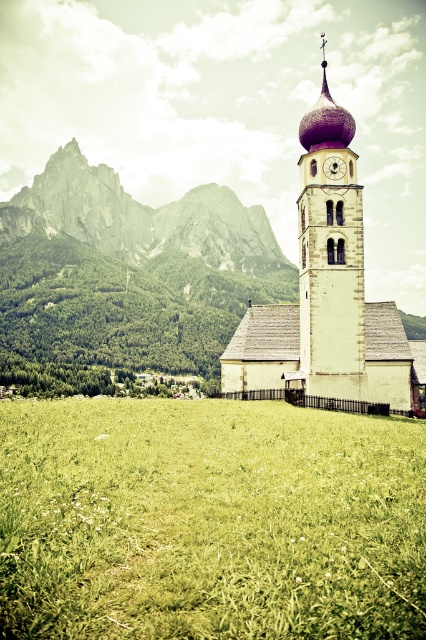
You are a tourist standing in front of the white stone church at center and want to take a photo that includes both the church and the gray rock formation at upper left. Based on their heights, which object should be placed closer to the bottom of the photo frame?

The white stone church at center has a lesser height compared to the gray rock formation at upper left, so the church should be placed closer to the bottom of the photo frame to ensure both objects fit within the frame.

You are standing at the entrance of the church and want to place a small decorative statue exactly at the center point of the green grass at center. According to the coordinates provided, what are the coordinates where you should place the statue?

The coordinates for the green grass at center are at point (209, 522), so you should place the statue at those coordinates.

You are standing in the meadow in front of the church and want to take a photo of the white stone church at center. The wooden clock at center is blocking your view. Can you move the clock to the side to get a clear shot?

The white stone church at center is positioned under the wooden clock at center, so the clock is directly above the church. Moving the clock might not be feasible as it is likely part of the church structure. Consider moving to a different angle where the clock is not obstructing the view.